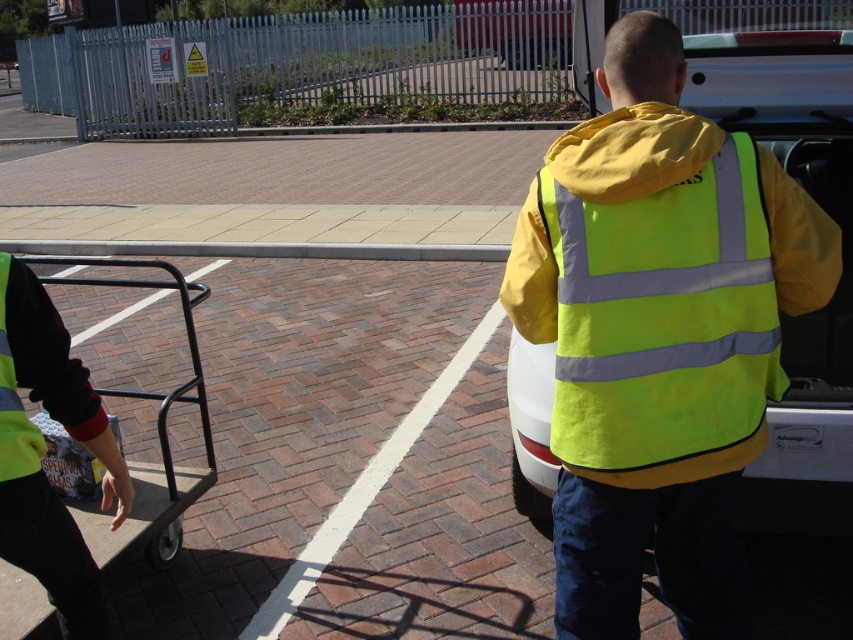
Question: Which point is farther to the camera?

Choices:
 (A) black metal cart at lower left
 (B) yellow reflective jacket at center

Answer: (A)

Question: Is the position of yellow reflective jacket at center less distant than that of black metal cart at lower left?

Choices:
 (A) no
 (B) yes

Answer: (B)

Question: Does yellow reflective jacket at center appear under black metal cart at lower left?

Choices:
 (A) yes
 (B) no

Answer: (B)

Question: Is yellow reflective jacket at center above black metal cart at lower left?

Choices:
 (A) yes
 (B) no

Answer: (A)